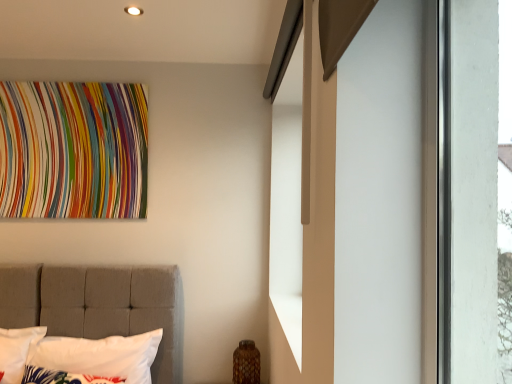
Question: Can you confirm if white fabric pillow at lower left, the 1th pillow viewed from the front, is smaller than white tufted pillow at left, which is the second pillow in front-to-back order?

Choices:
 (A) no
 (B) yes

Answer: (B)

Question: Is white fabric pillow at lower left, acting as the 2th pillow starting from the back, facing away from white tufted pillow at left, which is the second pillow in front-to-back order?

Choices:
 (A) no
 (B) yes

Answer: (B)

Question: From the image's perspective, is white fabric pillow at lower left, acting as the 2th pillow starting from the back, over white tufted pillow at left, the first pillow positioned from the back?

Choices:
 (A) yes
 (B) no

Answer: (B)

Question: Is white tufted pillow at left, the first pillow positioned from the back, located within white fabric pillow at lower left, acting as the 2th pillow starting from the back?

Choices:
 (A) yes
 (B) no

Answer: (B)

Question: From a real-world perspective, is white fabric pillow at lower left, acting as the 2th pillow starting from the back, located beneath white tufted pillow at left, which is the second pillow in front-to-back order?

Choices:
 (A) yes
 (B) no

Answer: (A)

Question: Is white fabric pillow at lower left, acting as the 2th pillow starting from the back, aimed at white tufted pillow at left, the first pillow positioned from the back?

Choices:
 (A) no
 (B) yes

Answer: (A)

Question: Is white fabric pillow at lower left, the 1th pillow viewed from the front, not near multicolored fabric tapestry at upper left?

Choices:
 (A) no
 (B) yes

Answer: (B)

Question: Is white fabric pillow at lower left, acting as the 2th pillow starting from the back, to the right of multicolored fabric tapestry at upper left from the viewer's perspective?

Choices:
 (A) yes
 (B) no

Answer: (A)

Question: Is multicolored fabric tapestry at upper left located within white fabric pillow at lower left, acting as the 2th pillow starting from the back?

Choices:
 (A) no
 (B) yes

Answer: (A)

Question: Considering the relative sizes of white fabric pillow at lower left, acting as the 2th pillow starting from the back, and multicolored fabric tapestry at upper left in the image provided, is white fabric pillow at lower left, acting as the 2th pillow starting from the back, smaller than multicolored fabric tapestry at upper left?

Choices:
 (A) no
 (B) yes

Answer: (B)

Question: Is white fabric pillow at lower left, the 1th pillow viewed from the front, positioned behind multicolored fabric tapestry at upper left?

Choices:
 (A) yes
 (B) no

Answer: (B)

Question: Is white fabric pillow at lower left, the 1th pillow viewed from the front, completely or partially outside of multicolored fabric tapestry at upper left?

Choices:
 (A) no
 (B) yes

Answer: (B)

Question: Does multicolored fabric tapestry at upper left have a lesser height compared to white tufted pillow at left, the first pillow positioned from the back?

Choices:
 (A) yes
 (B) no

Answer: (B)